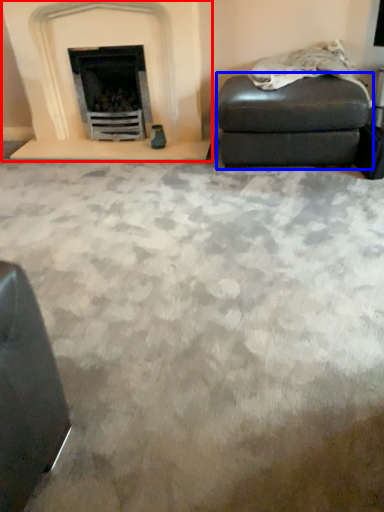
Question: Which of the following is the closest to the observer, fireplace (highlighted by a red box) or stool (highlighted by a blue box)?

Choices:
 (A) fireplace
 (B) stool

Answer: (B)